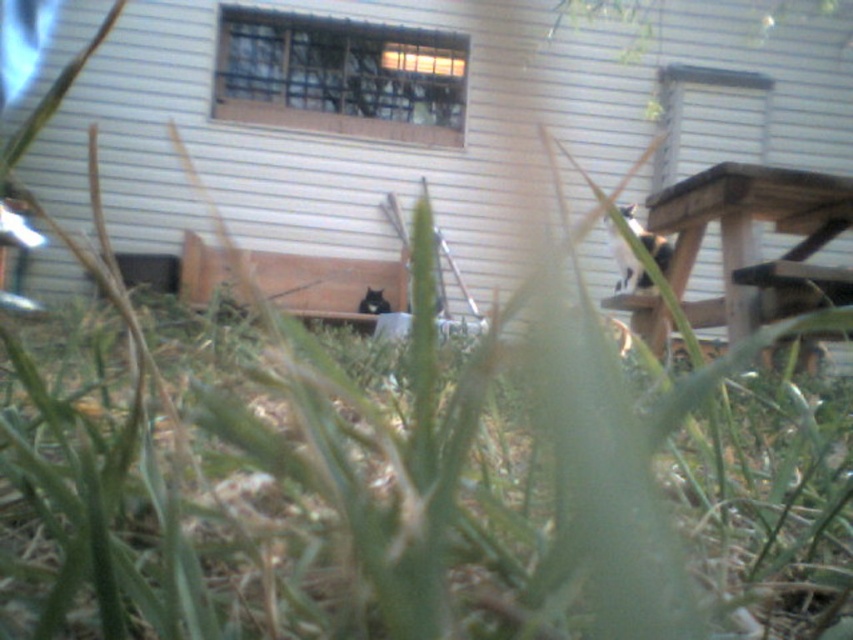
You are a photographer trying to capture both the white fur cat at upper right and the black fur cat at center in a single shot. Given that your camera can only focus on one subject at a time, which cat should you focus on to ensure the other remains in the background?

You should focus on the black fur cat at center because the white fur cat at upper right is larger in size, indicating it is closer to the camera. By focusing on the closer subject, the farther one will naturally be in the background.

In the scene shown: You are a photographer standing in the grassy foreground. You want to take a photo of both the white fur cat at upper right and the black fur cat at center. Which cat should you adjust your camera to focus on first to ensure both are in the frame?

You should focus on the black fur cat at center first because the white fur cat at upper right is to the right of it, so adjusting the camera to include both would require centering on the black fur cat at center first.